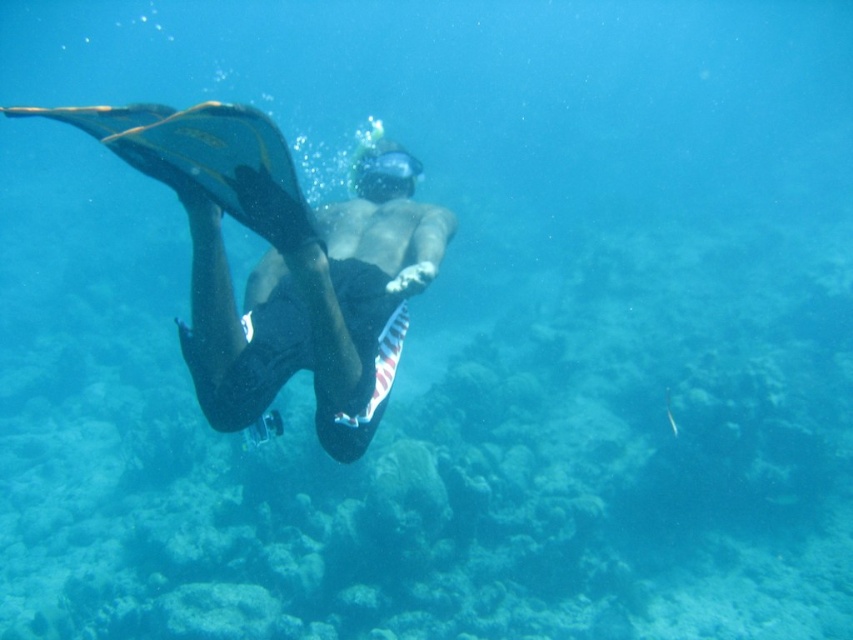
Between point (372, 332) and point (390, 161), which one is positioned behind?

The point (390, 161) is behind.

Is point (372, 301) farther from viewer compared to point (381, 154)?

No.

Locate an element on the screen. black matte shorts at center is located at coordinates (312, 312).